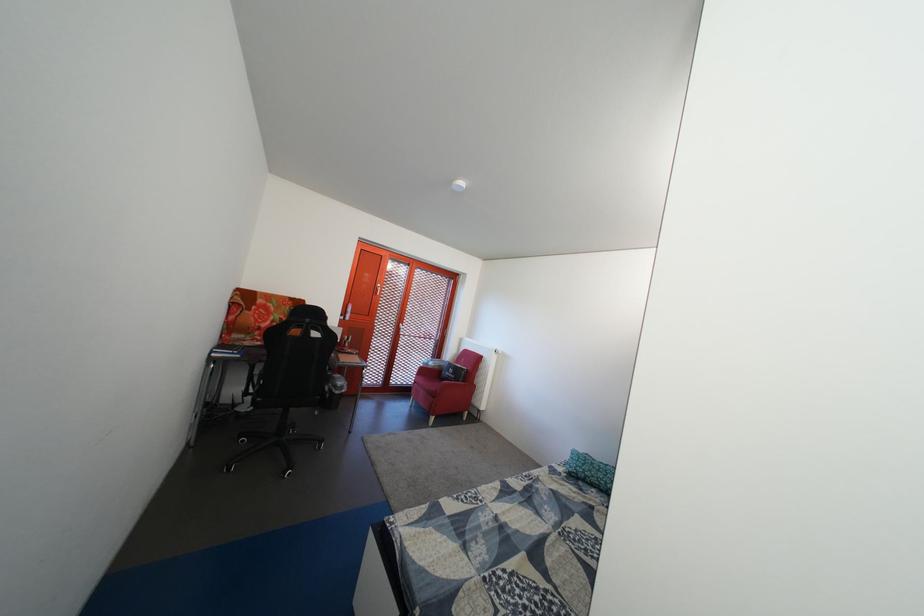
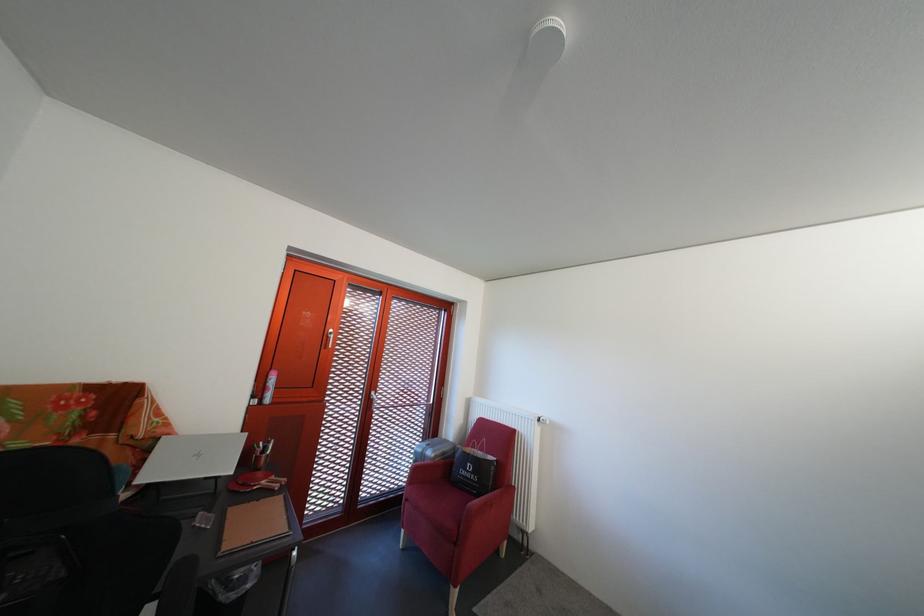
Find the pixel in the second image that matches [505,363] in the first image.

(549, 436)